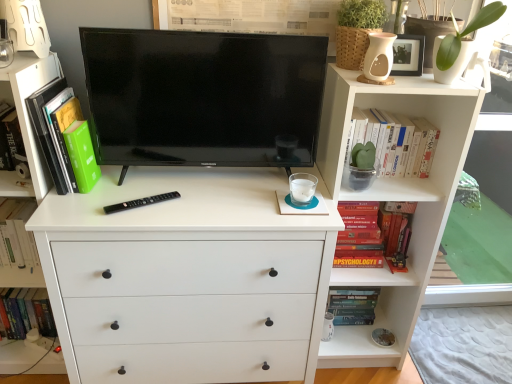
Image resolution: width=512 pixels, height=384 pixels. I want to click on free space on the front side of black glossy tv at center, so click(x=198, y=206).